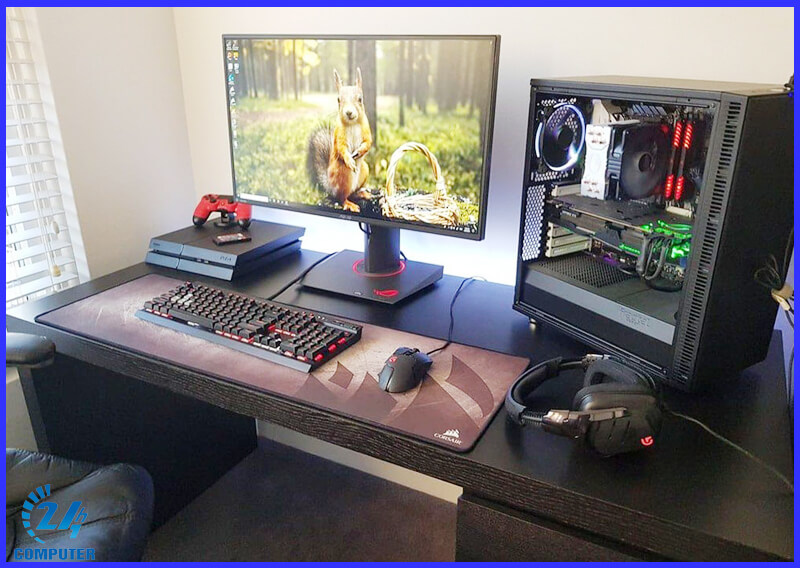
Locate an element on the screen. chair is located at coordinates (28, 483).